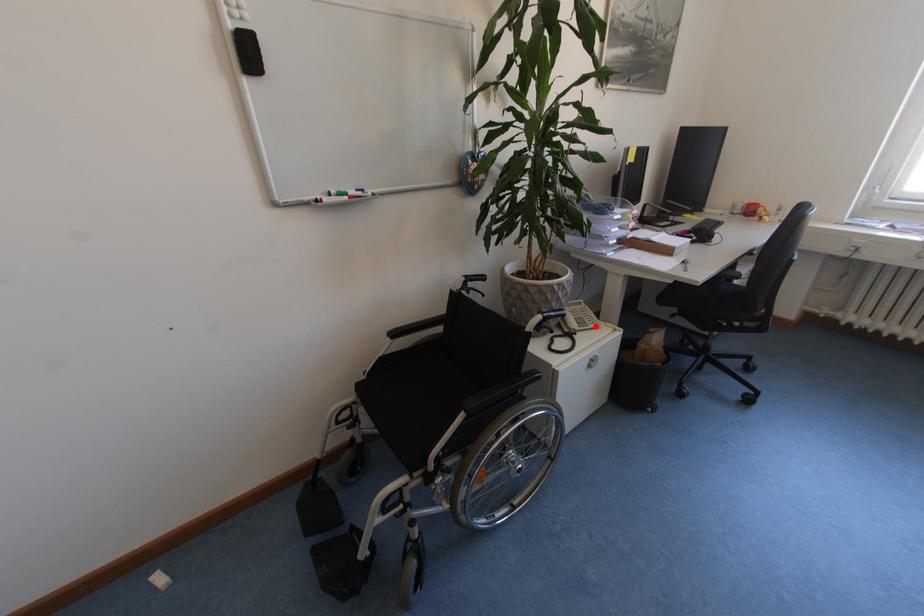
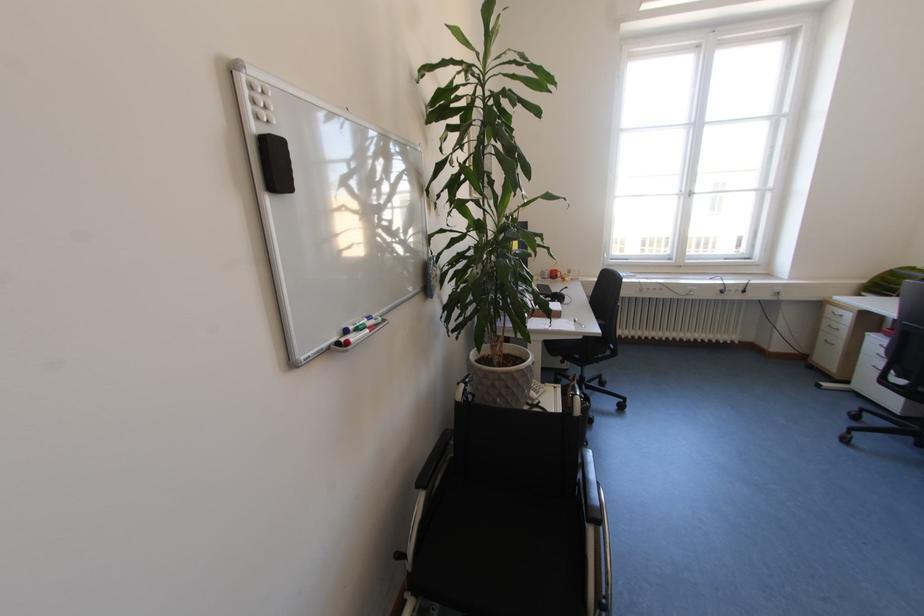
Where in the second image is the point corresponding to the highlighted location from the first image?

(546, 392)